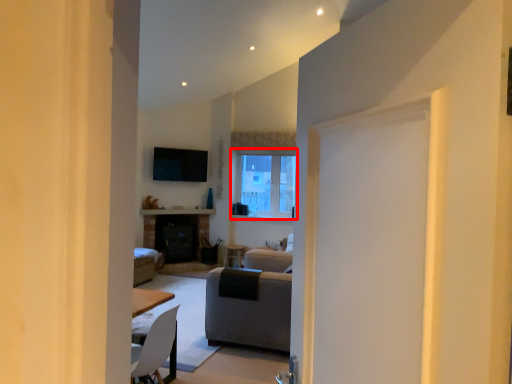
Question: From the image's perspective, where is window (annotated by the red box) located in relation to studio couch in the image?

Choices:
 (A) below
 (B) above

Answer: (B)